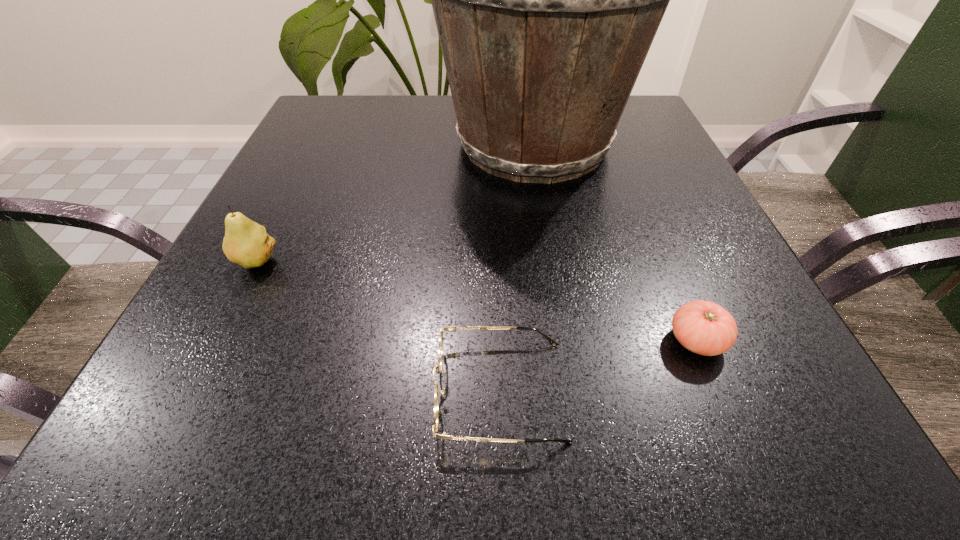
What are the coordinates of `vacant space located 0.280m on the lenses of the spectacles` in the screenshot? It's located at (x=214, y=390).

The height and width of the screenshot is (540, 960). In order to click on free spot located on the lenses of the spectacles in this screenshot , I will do `click(222, 390)`.

Identify the location of object that is at the far edge. (546, 0).

The image size is (960, 540). What are the coordinates of `object that is at the near edge` in the screenshot? It's located at (438, 367).

You are a GUI agent. You are given a task and a screenshot of the screen. Output one action in this format:
    pyautogui.click(x=<x>, y=<y>)
    Task: Click on the object at the left edge
    The height and width of the screenshot is (540, 960).
    Given the screenshot: What is the action you would take?
    pyautogui.click(x=246, y=243)

This screenshot has height=540, width=960. In order to click on bucket that is at the right edge in this screenshot , I will do `click(546, 0)`.

I want to click on tomato at the right edge, so [703, 327].

In order to click on object at the far right corner in this screenshot , I will do `click(546, 0)`.

Find the location of a particular element. The height and width of the screenshot is (540, 960). vacant space at the far edge of the desktop is located at coordinates pyautogui.click(x=392, y=140).

In the image, there is a desktop. At what (x,y) coordinates should I click in order to perform the action: click on vacant space at the near edge. Please return your answer as a coordinate pair (x, y). Looking at the image, I should click on (634, 418).